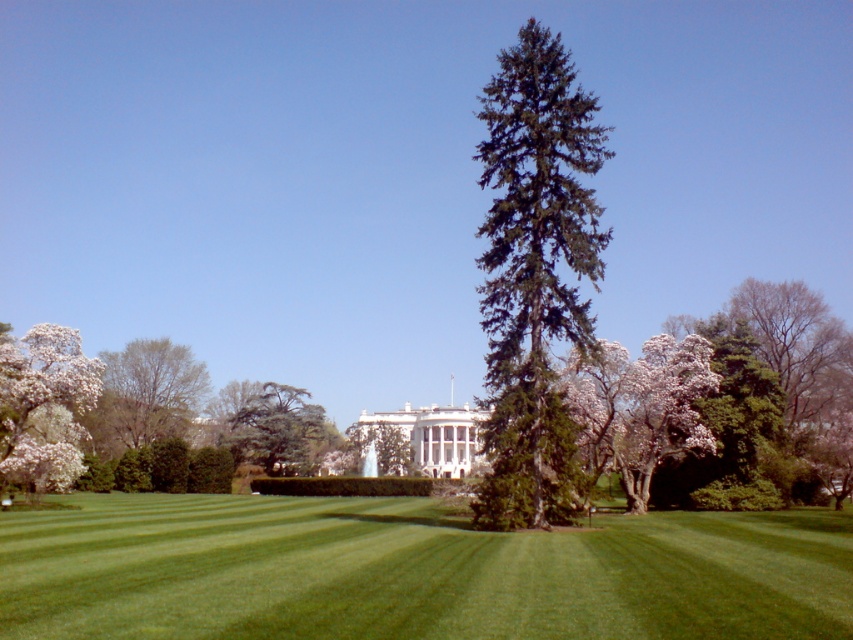
Question: Which of these objects is positioned closest to the green needle-like tree at center?

Choices:
 (A) green textured tree at center
 (B) green grassy at center
 (C) green leafy tree at left

Answer: (B)

Question: Can you confirm if green leafy tree at left is positioned to the left of green textured tree at center?

Choices:
 (A) yes
 (B) no

Answer: (A)

Question: Considering the real-world distances, which object is closest to the green grassy at center?

Choices:
 (A) white textured tree at right
 (B) green leafy tree at left
 (C) green textured tree at center

Answer: (A)

Question: Is green grassy at center thinner than green textured tree at center?

Choices:
 (A) yes
 (B) no

Answer: (B)

Question: Which point is farther to the camera?

Choices:
 (A) (802, 625)
 (B) (576, 147)

Answer: (B)

Question: Observing the image, what is the correct spatial positioning of white textured tree at right in reference to green textured tree at center?

Choices:
 (A) right
 (B) left

Answer: (A)